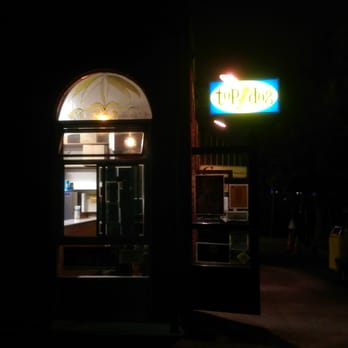
Locate an element on the screen. The height and width of the screenshot is (348, 348). window open is located at coordinates (106, 154).